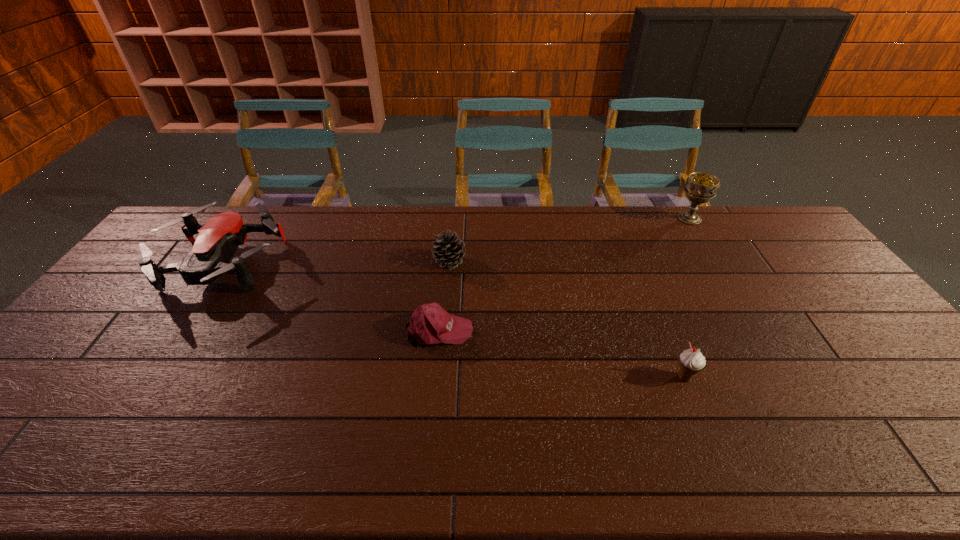
At what (x,y) coordinates should I click in order to perform the action: click on chalice. Please return your answer as a coordinate pair (x, y). Looking at the image, I should click on (700, 187).

Locate an element on the screen. The width and height of the screenshot is (960, 540). the farthest object is located at coordinates (700, 187).

The image size is (960, 540). Identify the location of the leftmost object. coord(219,238).

I want to click on pinecone, so click(448, 251).

Where is `icecream`? The image size is (960, 540). icecream is located at coordinates (691, 361).

Locate an element on the screen. This screenshot has width=960, height=540. the nearest object is located at coordinates (691, 361).

Find the location of a particular element. This screenshot has width=960, height=540. the shortest object is located at coordinates pyautogui.click(x=429, y=324).

You are a GUI agent. You are given a task and a screenshot of the screen. Output one action in this format:
    pyautogui.click(x=<x>, y=<y>)
    Task: Click on the second nearest object
    
    Given the screenshot: What is the action you would take?
    pyautogui.click(x=429, y=324)

At what (x,y) coordinates should I click in order to perform the action: click on free region located 0.150m on the right of the rightmost object. Please return your answer as a coordinate pair (x, y). The height and width of the screenshot is (540, 960). Looking at the image, I should click on (745, 219).

Identify the location of vacant position located 0.270m on the camera side of the leftmost object. The image size is (960, 540). click(x=140, y=391).